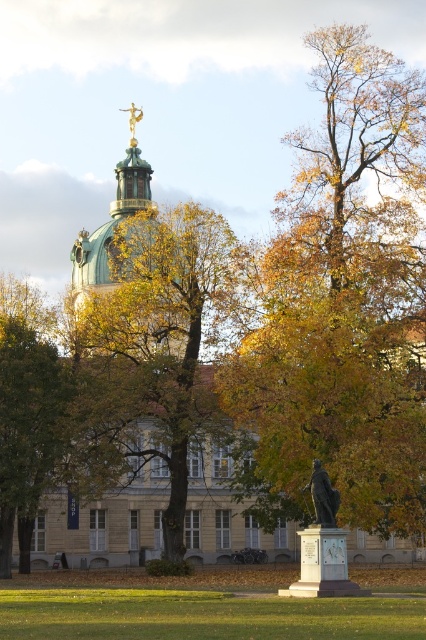
Is yellow-green leaves at center wider than gold metallic statue at upper center?

Yes, yellow-green leaves at center is wider than gold metallic statue at upper center.

Between yellow-green leaves at center and gold metallic statue at upper center, which one has less height?

gold metallic statue at upper center is shorter.

Which is behind, point (321, 92) or point (137, 109)?

The point (137, 109) is behind.

At what (x,y) coordinates should I click in order to perform the action: click on yellow-green leaves at center. Please return your answer as a coordinate pair (x, y). The image size is (426, 640). Looking at the image, I should click on (345, 300).

This screenshot has width=426, height=640. What do you see at coordinates (164, 339) in the screenshot? I see `golden-brown foliage at center` at bounding box center [164, 339].

You are a GUI agent. You are given a task and a screenshot of the screen. Output one action in this format:
    pyautogui.click(x=<x>, y=<y>)
    Task: Click on the golden-brown foliage at center
    Image resolution: width=426 pixels, height=640 pixels.
    Given the screenshot: What is the action you would take?
    pyautogui.click(x=164, y=339)

What do you see at coordinates (164, 339) in the screenshot? The image size is (426, 640). I see `golden-brown foliage at center` at bounding box center [164, 339].

You are a GUI agent. You are given a task and a screenshot of the screen. Output one action in this format:
    pyautogui.click(x=<x>, y=<y>)
    Task: Click on the golden-brown foliage at center
    This screenshot has width=426, height=640.
    Given the screenshot: What is the action you would take?
    pyautogui.click(x=164, y=339)

Between green copper dome at upper center and gold metallic statue at upper center, which one has less height?

Standing shorter between the two is gold metallic statue at upper center.

How much distance is there between green copper dome at upper center and gold metallic statue at upper center?

A distance of 42.74 feet exists between green copper dome at upper center and gold metallic statue at upper center.

Between point (77, 282) and point (132, 115), which one is positioned in front?

Positioned in front is point (77, 282).

The image size is (426, 640). I want to click on green copper dome at upper center, so click(109, 228).